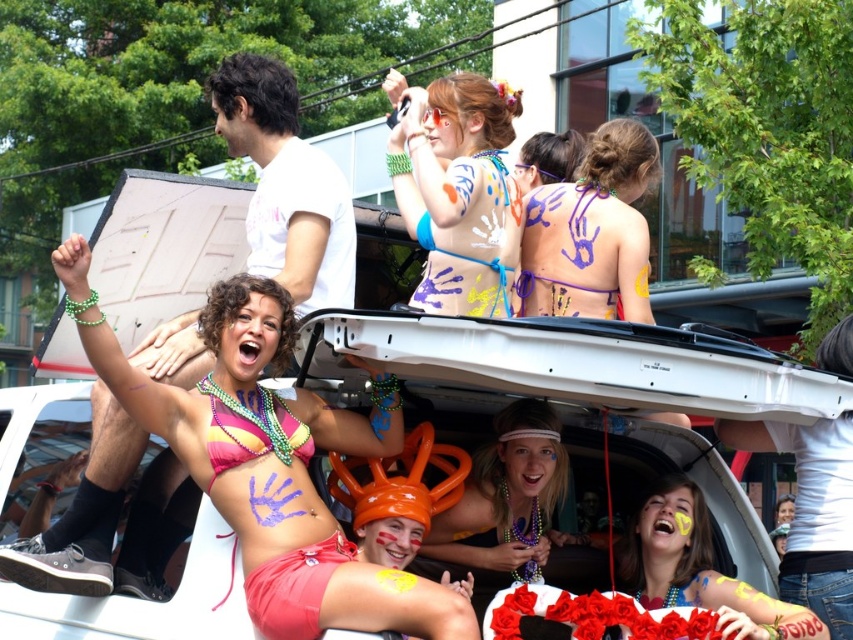
You are a photographer at the parade. You see the matte blue bikini top at center and the matte orange balloon at center. Which object is positioned higher in the image?

The matte blue bikini top at center is above the matte orange balloon at center, so the matte blue bikini top at center is positioned higher in the image.

You are a photographer at the parade trying to capture a photo of the matte blue bikini top at center and the white matte car at center. Which object should you focus on first if you want to include both in your shot without moving the camera?

The matte blue bikini top at center is located above the white matte car at center, so you should focus on the white matte car at center first to ensure both are in frame without moving the camera.

You are a photographer standing at the edge of the parade route. You want to capture a photo that includes both the purple painted hands at center and the matte pink bikini at center. Given that your camera has a maximum zoom range of 5 meters, will you be able to fit both subjects into the frame?

The purple painted hands at center and matte pink bikini at center are 9.04 meters apart, which exceeds the camera maximum zoom range of 5 meters. Therefore, you cannot fit both subjects into the frame.